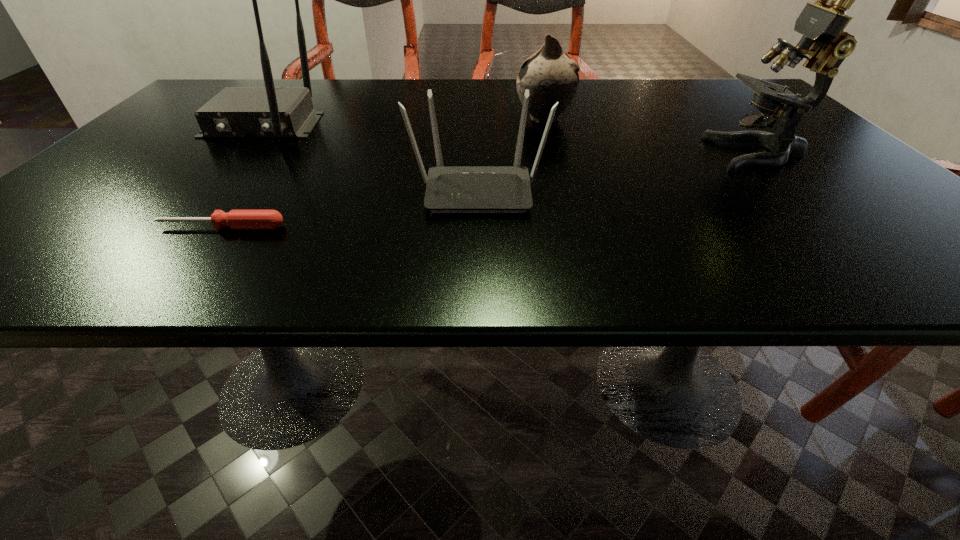
Where is `unoccupied area between the left router and the screwdriver`? The height and width of the screenshot is (540, 960). unoccupied area between the left router and the screwdriver is located at coordinates (242, 176).

Find the location of a particular element. empty space that is in between the nearest object and the pottery is located at coordinates (383, 173).

The image size is (960, 540). I want to click on vacant region between the second shortest object and the third tallest object, so click(x=511, y=154).

At what (x,y) coordinates should I click in order to perform the action: click on free point between the screwdriver and the shorter router. Please return your answer as a coordinate pair (x, y). The width and height of the screenshot is (960, 540). Looking at the image, I should click on (350, 208).

The height and width of the screenshot is (540, 960). What are the coordinates of `blank region between the third tallest object and the nearest object` in the screenshot? It's located at [383, 173].

Find the location of a particular element. This screenshot has height=540, width=960. vacant area that lies between the tallest object and the fourth tallest object is located at coordinates click(618, 171).

Select which object appears as the fourth closest to the pottery. Please provide its 2D coordinates. Your answer should be formatted as a tuple, i.e. [(x, y)], where the tuple contains the x and y coordinates of a point satisfying the conditions above.

[(236, 219)]

Where is `object that is the fourth closest one to the left router`? object that is the fourth closest one to the left router is located at coordinates (821, 23).

The width and height of the screenshot is (960, 540). I want to click on vacant region that satisfies the following two spatial constraints: 1. from the spout of the pottery; 2. on the back of the fourth shortest object to connect cables, so click(545, 125).

At what (x,y) coordinates should I click in order to perform the action: click on vacant space that satisfies the following two spatial constraints: 1. from the spout of the pottery; 2. on the front-facing side of the right router. Please return your answer as a coordinate pair (x, y). Looking at the image, I should click on (563, 190).